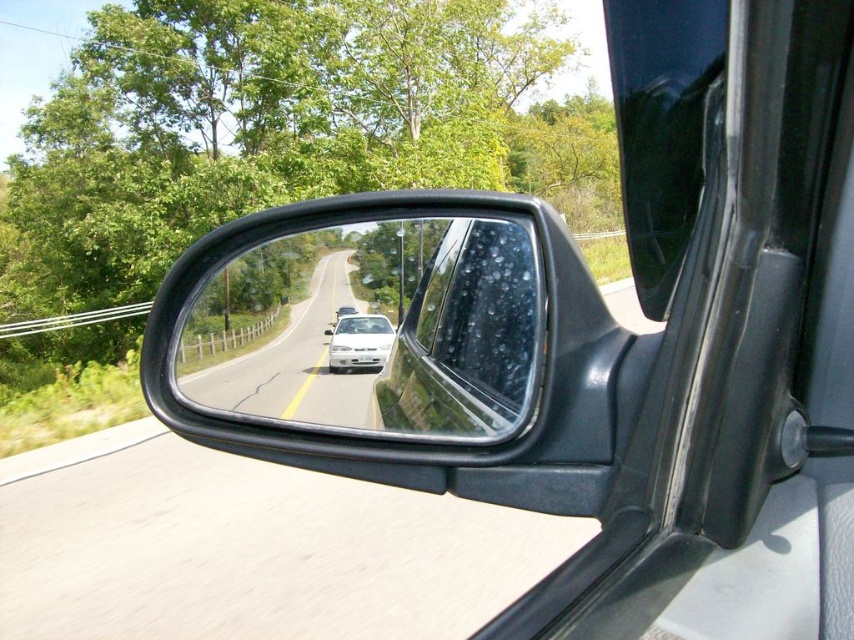
Is clear plastic mirror at center below white glossy car at center?

No.

How much distance is there between clear plastic mirror at center and white glossy car at center?

clear plastic mirror at center and white glossy car at center are 4.63 centimeters apart.

Which is in front, point (404, 337) or point (349, 380)?

Point (349, 380)

You are a GUI agent. You are given a task and a screenshot of the screen. Output one action in this format:
    pyautogui.click(x=<x>, y=<y>)
    Task: Click on the clear plastic mirror at center
    This screenshot has width=854, height=640.
    Given the screenshot: What is the action you would take?
    pyautogui.click(x=373, y=328)

Between point (449, 228) and point (496, 240), which one is positioned in front?

Positioned in front is point (496, 240).

Is clear plastic mirror at center above transparent wet glass at center?

No, clear plastic mirror at center is not above transparent wet glass at center.

Measure the distance between point (440, 374) and camera.

1.58 meters

Locate an element on the screen. This screenshot has height=640, width=854. clear plastic mirror at center is located at coordinates (373, 328).

Find the location of a particular element. clear plastic mirror at center is located at coordinates (373, 328).

Is point (314, 419) in front of point (382, 321)?

Yes.

Identify the location of clear plastic mirror at center. Image resolution: width=854 pixels, height=640 pixels. (373, 328).